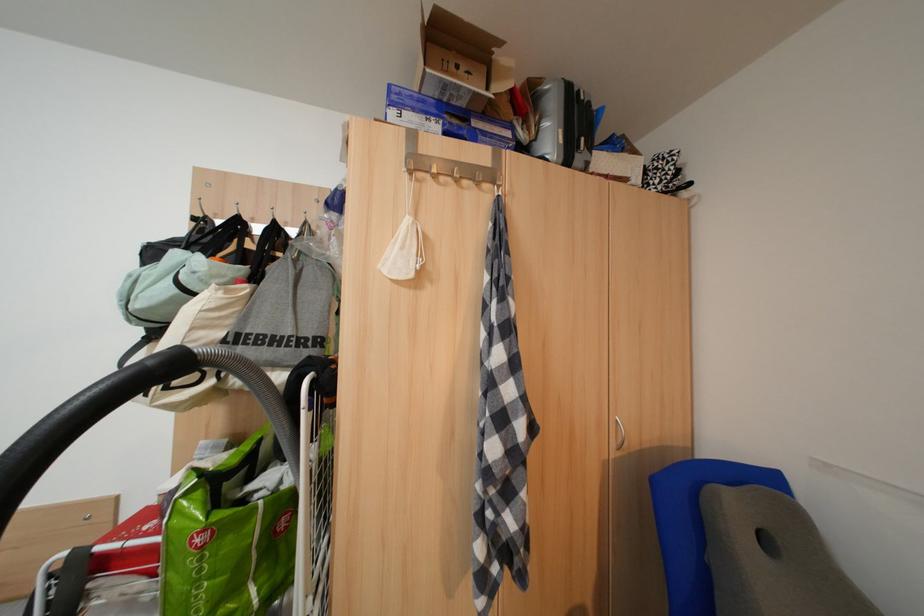
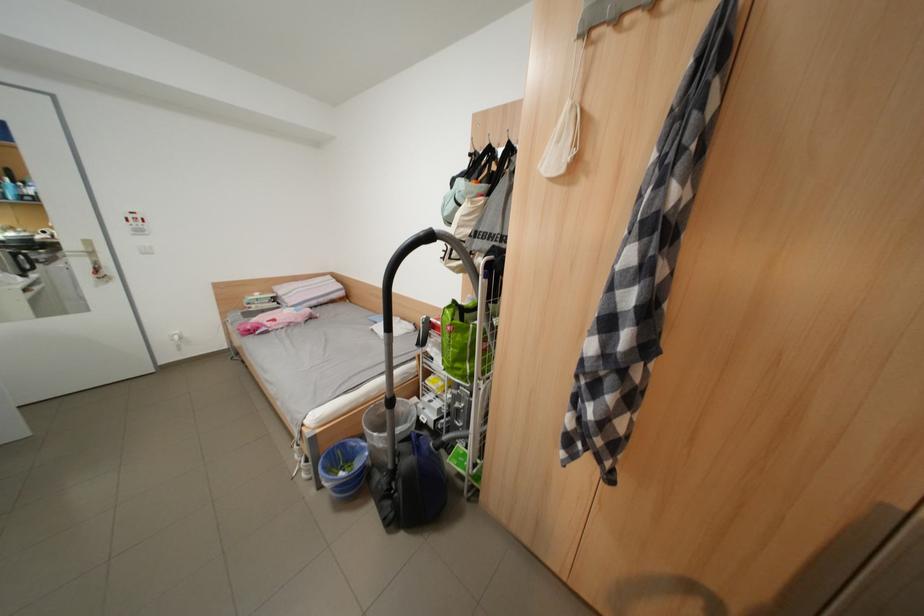
The point at (x=415, y=248) is marked in the first image. Where is the corresponding point in the second image?

(569, 142)